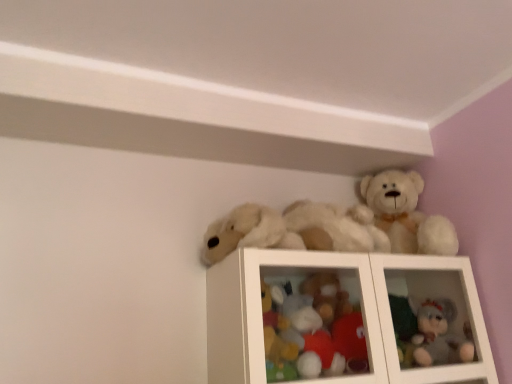
Describe the element at coordinates (312, 329) in the screenshot. I see `fluffy fabric teddy bear at upper right, which is the 2th toy from right to left` at that location.

Based on the photo, how much space does fluffy fabric teddy bear at upper right, which is the 2th toy from right to left, occupy vertically?

fluffy fabric teddy bear at upper right, which is the 2th toy from right to left, is 9.92 inches in height.

Locate an element on the screen. white plush bear at upper center, the third toy viewed from the right is located at coordinates (339, 224).

Could you tell me if gray plush bear at upper right, which ranks as the third toy in left-to-right order, is turned towards white plush bear at upper center, the third toy viewed from the right?

No, gray plush bear at upper right, which ranks as the third toy in left-to-right order, is not oriented towards white plush bear at upper center, the third toy viewed from the right.

Is gray plush bear at upper right, the first toy positioned from the right, beside white plush bear at upper center, the third toy viewed from the right?

No, gray plush bear at upper right, the first toy positioned from the right, is not with white plush bear at upper center, the third toy viewed from the right.

From the image's perspective, count 2nd toys upward from the gray plush bear at upper right, the first toy positioned from the right, and point to it. Please provide its 2D coordinates.

[(339, 224)]

From the picture: From a real-world perspective, relative to gray plush bear at upper right, the first toy positioned from the right, is white plush bear at upper center, which is the first toy in left-to-right order, vertically above or below?

From a real-world perspective, white plush bear at upper center, which is the first toy in left-to-right order, is physically above gray plush bear at upper right, the first toy positioned from the right.

Considering the positions of objects white plush bear at upper center, the third toy viewed from the right, and gray plush bear at upper right, which ranks as the third toy in left-to-right order, in the image provided, who is more to the right, white plush bear at upper center, the third toy viewed from the right, or gray plush bear at upper right, which ranks as the third toy in left-to-right order,?

gray plush bear at upper right, which ranks as the third toy in left-to-right order.

Would you consider white plush bear at upper center, which is the first toy in left-to-right order, to be distant from gray plush bear at upper right, the first toy positioned from the right?

white plush bear at upper center, which is the first toy in left-to-right order, is actually quite close to gray plush bear at upper right, the first toy positioned from the right.

Which of these two, white plush bear at upper center, which is the first toy in left-to-right order, or gray plush bear at upper right, the first toy positioned from the right, is smaller?

gray plush bear at upper right, the first toy positioned from the right, is smaller.

From the image's perspective, is gray plush bear at upper right, which ranks as the third toy in left-to-right order, on fluffy fabric teddy bear at upper right, acting as the second toy starting from the left?

No, from the image's perspective, gray plush bear at upper right, which ranks as the third toy in left-to-right order, is not over fluffy fabric teddy bear at upper right, acting as the second toy starting from the left.

Consider the image. Is gray plush bear at upper right, the first toy positioned from the right, thinner than fluffy fabric teddy bear at upper right, acting as the second toy starting from the left?

No, gray plush bear at upper right, the first toy positioned from the right, is not thinner than fluffy fabric teddy bear at upper right, acting as the second toy starting from the left.

Considering the points (424, 349) and (269, 377), which point is in front, point (424, 349) or point (269, 377)?

The point (269, 377) is closer to the camera.

Locate an element on the screen. This screenshot has width=512, height=384. the 1st toy behind the white plush bear at upper center, which is the first toy in left-to-right order is located at coordinates (312, 329).

Can you confirm if fluffy fabric teddy bear at upper right, acting as the second toy starting from the left, is thinner than white plush bear at upper center, which is the first toy in left-to-right order?

Indeed, fluffy fabric teddy bear at upper right, acting as the second toy starting from the left, has a lesser width compared to white plush bear at upper center, which is the first toy in left-to-right order.

From a real-world perspective, is fluffy fabric teddy bear at upper right, acting as the second toy starting from the left, physically below white plush bear at upper center, the third toy viewed from the right?

Yes, from a real-world perspective, fluffy fabric teddy bear at upper right, acting as the second toy starting from the left, is under white plush bear at upper center, the third toy viewed from the right.

Are fluffy fabric teddy bear at upper right, acting as the second toy starting from the left, and white plush bear at upper center, which is the first toy in left-to-right order, beside each other?

fluffy fabric teddy bear at upper right, acting as the second toy starting from the left, is not next to white plush bear at upper center, which is the first toy in left-to-right order, and they're not touching.

From the image's perspective, relative to gray plush bear at upper right, which ranks as the third toy in left-to-right order, is fluffy fabric teddy bear at upper right, which is the 2th toy from right to left, above or below?

From the image's perspective, fluffy fabric teddy bear at upper right, which is the 2th toy from right to left, appears above gray plush bear at upper right, which ranks as the third toy in left-to-right order.

From a real-world perspective, who is located higher, fluffy fabric teddy bear at upper right, acting as the second toy starting from the left, or gray plush bear at upper right, the first toy positioned from the right?

fluffy fabric teddy bear at upper right, acting as the second toy starting from the left, is physically above.

In the image, is fluffy fabric teddy bear at upper right, which is the 2th toy from right to left, positioned in front of or behind gray plush bear at upper right, the first toy positioned from the right?

fluffy fabric teddy bear at upper right, which is the 2th toy from right to left, is positioned closer to the viewer than gray plush bear at upper right, the first toy positioned from the right.

Which is more to the left, fluffy fabric teddy bear at upper right, acting as the second toy starting from the left, or gray plush bear at upper right, which ranks as the third toy in left-to-right order?

fluffy fabric teddy bear at upper right, acting as the second toy starting from the left, is more to the left.

From the image's perspective, which one is positioned lower, white plush bear at upper center, the third toy viewed from the right, or fluffy fabric teddy bear at upper right, which is the 2th toy from right to left?

fluffy fabric teddy bear at upper right, which is the 2th toy from right to left, is shown below in the image.

Which of these two, white plush bear at upper center, which is the first toy in left-to-right order, or fluffy fabric teddy bear at upper right, which is the 2th toy from right to left, is smaller?

With smaller size is fluffy fabric teddy bear at upper right, which is the 2th toy from right to left.

Based on the photo, would you say white plush bear at upper center, which is the first toy in left-to-right order, is a long distance from fluffy fabric teddy bear at upper right, which is the 2th toy from right to left?

No.

The width and height of the screenshot is (512, 384). There is a white plush bear at upper center, which is the first toy in left-to-right order. What are the coordinates of `the 2nd toy below it (from a real-world perspective)` in the screenshot? It's located at (440, 335).

Image resolution: width=512 pixels, height=384 pixels. I want to click on toy that is the 2nd object to the left of the gray plush bear at upper right, the first toy positioned from the right, starting at the anchor, so click(339, 224).

Estimate the real-world distances between objects in this image. Which object is closer to white plush bear at upper center, the third toy viewed from the right, gray plush bear at upper right, the first toy positioned from the right, or fluffy fabric teddy bear at upper right, which is the 2th toy from right to left?

fluffy fabric teddy bear at upper right, which is the 2th toy from right to left.

Considering their positions, is gray plush bear at upper right, the first toy positioned from the right, positioned further to fluffy fabric teddy bear at upper right, which is the 2th toy from right to left, than white plush bear at upper center, the third toy viewed from the right?

Among the two, gray plush bear at upper right, the first toy positioned from the right, is located further to fluffy fabric teddy bear at upper right, which is the 2th toy from right to left.

Looking at the image, which one is located further to gray plush bear at upper right, the first toy positioned from the right, white plush bear at upper center, which is the first toy in left-to-right order, or fluffy fabric teddy bear at upper right, acting as the second toy starting from the left?

white plush bear at upper center, which is the first toy in left-to-right order, lies further to gray plush bear at upper right, the first toy positioned from the right, than the other object.

When comparing their distances from white plush bear at upper center, the third toy viewed from the right, does fluffy fabric teddy bear at upper right, acting as the second toy starting from the left, or gray plush bear at upper right, which ranks as the third toy in left-to-right order, seem further?

gray plush bear at upper right, which ranks as the third toy in left-to-right order, is positioned further to the anchor white plush bear at upper center, the third toy viewed from the right.

From the image, which object appears to be farther from gray plush bear at upper right, which ranks as the third toy in left-to-right order, fluffy fabric teddy bear at upper right, acting as the second toy starting from the left, or white plush bear at upper center, the third toy viewed from the right?

white plush bear at upper center, the third toy viewed from the right.

Looking at the image, which one is located closer to fluffy fabric teddy bear at upper right, acting as the second toy starting from the left, white plush bear at upper center, the third toy viewed from the right, or gray plush bear at upper right, the first toy positioned from the right?

Based on the image, white plush bear at upper center, the third toy viewed from the right, appears to be nearer to fluffy fabric teddy bear at upper right, acting as the second toy starting from the left.

The width and height of the screenshot is (512, 384). Identify the location of toy between white plush bear at upper center, which is the first toy in left-to-right order, and gray plush bear at upper right, which ranks as the third toy in left-to-right order, from left to right. tap(312, 329).